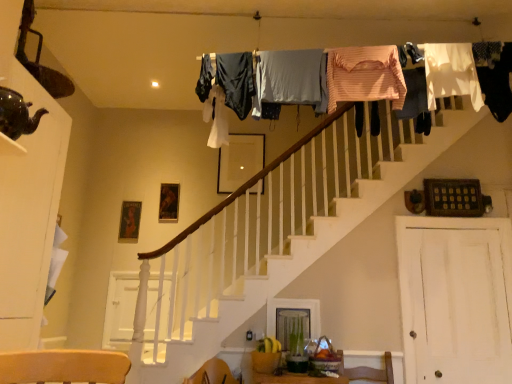
This screenshot has height=384, width=512. Describe the element at coordinates (121, 309) in the screenshot. I see `white painted wood at lower left, arranged as the second barn door when viewed from the right` at that location.

Based on the photo, how much space does white painted wood at lower left, the first barn door when ordered from left to right, occupy horizontally?

It is 5.34 centimeters.

The image size is (512, 384). What do you see at coordinates (414, 94) in the screenshot? I see `pink fabric at upper right, which is the fifth clothing from left to right` at bounding box center [414, 94].

This screenshot has width=512, height=384. What do you see at coordinates (495, 78) in the screenshot? I see `black fabric at upper right, the first clothing positioned from the right` at bounding box center [495, 78].

What do you see at coordinates (365, 75) in the screenshot? I see `pink striped fabric at upper center, which is the 4th clothing from left to right` at bounding box center [365, 75].

Describe the element at coordinates (17, 115) in the screenshot. The width and height of the screenshot is (512, 384). I see `shiny dark green teapot at upper left` at that location.

You are a GUI agent. You are given a task and a screenshot of the screen. Output one action in this format:
    pyautogui.click(x=<x>, y=<y>)
    Task: Click on the white painted wood at lower left, the first barn door when ordered from left to right
    
    Given the screenshot: What is the action you would take?
    pyautogui.click(x=121, y=309)

Does dark blue fabric at upper center, placed as the sixth clothing when sorted from right to left, have a lesser height compared to dark blue fabric at upper center, which is the 7th clothing in right-to-left order?

No.

From a real-world perspective, which is physically below, dark blue fabric at upper center, marked as the second clothing in a left-to-right arrangement, or dark blue fabric at upper center, positioned as the first clothing in left-to-right order?

dark blue fabric at upper center, marked as the second clothing in a left-to-right arrangement, is physically lower.

Looking at this image, is dark blue fabric at upper center, marked as the second clothing in a left-to-right arrangement, looking in the opposite direction of dark blue fabric at upper center, which is the 7th clothing in right-to-left order?

No, dark blue fabric at upper center, which is the 7th clothing in right-to-left order, is not at the back of dark blue fabric at upper center, marked as the second clothing in a left-to-right arrangement.

Is dark blue fabric at upper center, positioned as the first clothing in left-to-right order, located outside dark blue fabric at upper center, marked as the second clothing in a left-to-right arrangement?

That's correct, dark blue fabric at upper center, positioned as the first clothing in left-to-right order, is outside of dark blue fabric at upper center, marked as the second clothing in a left-to-right arrangement.

Are dark blue fabric at upper center, which is the 7th clothing in right-to-left order, and dark blue fabric at upper center, marked as the second clothing in a left-to-right arrangement, located far from each other?

That's not correct — dark blue fabric at upper center, which is the 7th clothing in right-to-left order, is a little close to dark blue fabric at upper center, marked as the second clothing in a left-to-right arrangement.

From the image's perspective, is dark blue fabric at upper center, which is the 7th clothing in right-to-left order, above or below dark blue fabric at upper center, placed as the sixth clothing when sorted from right to left?

Based on their image positions, dark blue fabric at upper center, which is the 7th clothing in right-to-left order, is located above dark blue fabric at upper center, placed as the sixth clothing when sorted from right to left.

Considering the positions of objects black fabric at upper right, the first clothing positioned from the right, and pink fabric at upper right, placed as the 3th clothing when sorted from right to left, in the image provided, who is more to the left, black fabric at upper right, the first clothing positioned from the right, or pink fabric at upper right, placed as the 3th clothing when sorted from right to left,?

From the viewer's perspective, pink fabric at upper right, placed as the 3th clothing when sorted from right to left, appears more on the left side.

Can you confirm if black fabric at upper right, positioned as the 7th clothing in left-to-right order, is smaller than pink fabric at upper right, placed as the 3th clothing when sorted from right to left?

Incorrect, black fabric at upper right, positioned as the 7th clothing in left-to-right order, is not smaller in size than pink fabric at upper right, placed as the 3th clothing when sorted from right to left.

Is black fabric at upper right, positioned as the 7th clothing in left-to-right order, taller than pink fabric at upper right, placed as the 3th clothing when sorted from right to left?

Correct, black fabric at upper right, positioned as the 7th clothing in left-to-right order, is much taller as pink fabric at upper right, placed as the 3th clothing when sorted from right to left.

Considering the positions of objects shiny dark green teapot at upper left and white wood door at right, marked as the 1th barn door in a right-to-left arrangement, in the image provided, who is more to the left, shiny dark green teapot at upper left or white wood door at right, marked as the 1th barn door in a right-to-left arrangement,?

shiny dark green teapot at upper left.

Is shiny dark green teapot at upper left in front of white wood door at right, which ranks as the second barn door in left-to-right order?

Yes, shiny dark green teapot at upper left is closer to the viewer.

How many degrees apart are the facing directions of shiny dark green teapot at upper left and white wood door at right, the 2th barn door positioned from the back?

There is a 90.1-degree angle between the facing directions of shiny dark green teapot at upper left and white wood door at right, the 2th barn door positioned from the back.

Is shiny dark green teapot at upper left in contact with white wood door at right, which ranks as the second barn door in left-to-right order?

There is a gap between shiny dark green teapot at upper left and white wood door at right, which ranks as the second barn door in left-to-right order.

In the scene shown: Is white painted wood at lower left, arranged as the second barn door when viewed from the right, wider than wooden picture frame at center?

No, white painted wood at lower left, arranged as the second barn door when viewed from the right, is not wider than wooden picture frame at center.

From the picture: Measure the distance between white painted wood at lower left, the first barn door when ordered from left to right, and wooden picture frame at center.

white painted wood at lower left, the first barn door when ordered from left to right, is 1.66 meters away from wooden picture frame at center.

Considering the sizes of objects white painted wood at lower left, arranged as the second barn door when viewed from the right, and wooden picture frame at center in the image provided, who is smaller, white painted wood at lower left, arranged as the second barn door when viewed from the right, or wooden picture frame at center?

wooden picture frame at center.

From the image's perspective, count 2nd barn doors downward from the wooden picture frame at center and point to it. Please provide its 2D coordinates.

[(121, 309)]

Is light gray fabric at upper center, which ranks as the fifth clothing in right-to-left order, wider than pink fabric at upper right, which is the fifth clothing from left to right?

Yes.

Is light gray fabric at upper center, which ranks as the fifth clothing in right-to-left order, directly adjacent to pink fabric at upper right, placed as the 3th clothing when sorted from right to left?

light gray fabric at upper center, which ranks as the fifth clothing in right-to-left order, is not next to pink fabric at upper right, placed as the 3th clothing when sorted from right to left, and they're not touching.

Looking at this image, from a real-world perspective, between light gray fabric at upper center, acting as the 3th clothing starting from the left, and pink fabric at upper right, which is the fifth clothing from left to right, who is vertically lower?

light gray fabric at upper center, acting as the 3th clothing starting from the left.

Are light gray fabric at upper center, acting as the 3th clothing starting from the left, and white painted wood at lower left, the first barn door when ordered from left to right, making contact?

No.

Consider the image. Is light gray fabric at upper center, which ranks as the fifth clothing in right-to-left order, completely or partially outside of white painted wood at lower left, the 2th barn door when ordered from front to back?

Yes.

Considering the sizes of objects light gray fabric at upper center, which ranks as the fifth clothing in right-to-left order, and white painted wood at lower left, arranged as the second barn door when viewed from the right, in the image provided, who is bigger, light gray fabric at upper center, which ranks as the fifth clothing in right-to-left order, or white painted wood at lower left, arranged as the second barn door when viewed from the right,?

light gray fabric at upper center, which ranks as the fifth clothing in right-to-left order, is bigger.

The width and height of the screenshot is (512, 384). I want to click on the 2nd barn door behind the light gray fabric at upper center, acting as the 3th clothing starting from the left, so click(121, 309).

Which clothing is the 1st one when counting from the front of the dark blue fabric at upper center, positioned as the first clothing in left-to-right order? Please provide its 2D coordinates.

[(236, 81)]

Image resolution: width=512 pixels, height=384 pixels. I want to click on clothing that is the 2nd one above the dark blue fabric at upper center, marked as the second clothing in a left-to-right arrangement (from a real-world perspective), so click(x=205, y=78).

From the image, which object appears to be farther from light gray fabric at upper center, which ranks as the fifth clothing in right-to-left order, wooden picture frame at center or white fabric at upper right, the sixth clothing in the left-to-right sequence?

The object further to light gray fabric at upper center, which ranks as the fifth clothing in right-to-left order, is wooden picture frame at center.

When comparing their distances from dark blue fabric at upper center, positioned as the first clothing in left-to-right order, does dark blue fabric at upper center, placed as the sixth clothing when sorted from right to left, or white wood door at right, which ranks as the second barn door in left-to-right order, seem further?

The object further to dark blue fabric at upper center, positioned as the first clothing in left-to-right order, is white wood door at right, which ranks as the second barn door in left-to-right order.

When comparing their distances from wooden picture frame at center, does white wood door at right, arranged as the 1th barn door when viewed from the front, or light gray fabric at upper center, acting as the 3th clothing starting from the left, seem further?

The object further to wooden picture frame at center is white wood door at right, arranged as the 1th barn door when viewed from the front.

Estimate the real-world distances between objects in this image. Which object is closer to black fabric at upper right, positioned as the 7th clothing in left-to-right order, white wood door at right, which ranks as the second barn door in left-to-right order, or dark blue fabric at upper center, marked as the second clothing in a left-to-right arrangement?

white wood door at right, which ranks as the second barn door in left-to-right order, is positioned closer to the anchor black fabric at upper right, positioned as the 7th clothing in left-to-right order.

When comparing their distances from shiny dark green teapot at upper left, does white fabric at upper right, the 2th clothing positioned from the right, or white wood door at right, which ranks as the second barn door in left-to-right order, seem further?

white wood door at right, which ranks as the second barn door in left-to-right order.

Considering their positions, is white fabric at upper right, the 2th clothing positioned from the right, positioned further to light gray fabric at upper center, which ranks as the fifth clothing in right-to-left order, than pink striped fabric at upper center, which is the 4th clothing from left to right?

white fabric at upper right, the 2th clothing positioned from the right, is further to light gray fabric at upper center, which ranks as the fifth clothing in right-to-left order.

Considering their positions, is wooden picture frame at center positioned closer to pink fabric at upper right, placed as the 3th clothing when sorted from right to left, than pink striped fabric at upper center, which is the 4th clothing from left to right?

Among the two, pink striped fabric at upper center, which is the 4th clothing from left to right, is located nearer to pink fabric at upper right, placed as the 3th clothing when sorted from right to left.

Considering their positions, is shiny dark green teapot at upper left positioned closer to white painted wood at lower left, the 1th barn door viewed from the back, than wooden picture frame at center?

Based on the image, wooden picture frame at center appears to be nearer to white painted wood at lower left, the 1th barn door viewed from the back.

Identify the location of barn door located between white painted wood at lower left, the 1th barn door viewed from the back, and black fabric at upper right, the first clothing positioned from the right, in the left-right direction. The image size is (512, 384). (455, 299).

Where is `picture frame between white painted wood at lower left, the 2th barn door when ordered from front to back, and white wood door at right, the 2th barn door positioned from the back`? picture frame between white painted wood at lower left, the 2th barn door when ordered from front to back, and white wood door at right, the 2th barn door positioned from the back is located at coordinates (240, 161).

Where is `picture frame between white painted wood at lower left, the 1th barn door viewed from the back, and white fabric at upper right, the 2th clothing positioned from the right, in the horizontal direction`? This screenshot has width=512, height=384. picture frame between white painted wood at lower left, the 1th barn door viewed from the back, and white fabric at upper right, the 2th clothing positioned from the right, in the horizontal direction is located at coordinates (240, 161).

Where is `clothing between light gray fabric at upper center, acting as the 3th clothing starting from the left, and white painted wood at lower left, the first barn door when ordered from left to right, in the vertical direction`? Image resolution: width=512 pixels, height=384 pixels. clothing between light gray fabric at upper center, acting as the 3th clothing starting from the left, and white painted wood at lower left, the first barn door when ordered from left to right, in the vertical direction is located at coordinates (236, 81).